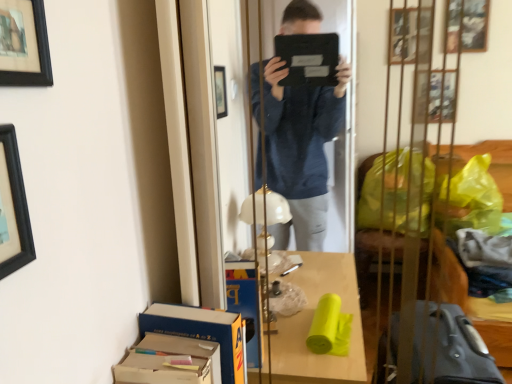
Locate an element on the screen. This screenshot has height=384, width=512. black matte picture frame at upper left, the first picture frame positioned from the bottom is located at coordinates (13, 207).

The width and height of the screenshot is (512, 384). What do you see at coordinates (201, 332) in the screenshot? I see `cardboard box at lower left, the 2th cardboard box in the front-to-back sequence` at bounding box center [201, 332].

Describe the element at coordinates (24, 44) in the screenshot. I see `black matte picture frame at upper left, which appears as the 1th picture frame when viewed from the top` at that location.

This screenshot has width=512, height=384. Identify the location of cardboard box at lower left, arranged as the 2th cardboard box when viewed from the back. (168, 361).

Where is `black matte picture frame at upper left, acting as the second picture frame starting from the top`? black matte picture frame at upper left, acting as the second picture frame starting from the top is located at coordinates (13, 207).

From their relative heights in the image, would you say cardboard box at lower left, which ranks as the first cardboard box in front-to-back order, is taller or shorter than cardboard box at lower left, the 1th cardboard box when ordered from back to front?

Clearly, cardboard box at lower left, which ranks as the first cardboard box in front-to-back order, is shorter compared to cardboard box at lower left, the 1th cardboard box when ordered from back to front.

Looking at this image, from a real-world perspective, is cardboard box at lower left, arranged as the 2th cardboard box when viewed from the back, positioned above or below cardboard box at lower left, the 1th cardboard box when ordered from back to front?

Clearly, from a real-world perspective, cardboard box at lower left, arranged as the 2th cardboard box when viewed from the back, is below cardboard box at lower left, the 1th cardboard box when ordered from back to front.

Which is correct: cardboard box at lower left, which ranks as the first cardboard box in front-to-back order, is inside cardboard box at lower left, the 2th cardboard box in the front-to-back sequence, or outside of it?

cardboard box at lower left, which ranks as the first cardboard box in front-to-back order, is outside cardboard box at lower left, the 2th cardboard box in the front-to-back sequence.

From the image's perspective, is cardboard box at lower left, which ranks as the first cardboard box in front-to-back order, located beneath cardboard box at lower left, the 1th cardboard box when ordered from back to front?

Yes, from the image's perspective, cardboard box at lower left, which ranks as the first cardboard box in front-to-back order, is beneath cardboard box at lower left, the 1th cardboard box when ordered from back to front.

Where is `cardboard box that is the 2nd object located behind the black matte picture frame at upper left, acting as the second picture frame starting from the top`? cardboard box that is the 2nd object located behind the black matte picture frame at upper left, acting as the second picture frame starting from the top is located at coordinates (201, 332).

Looking at this image, is the position of cardboard box at lower left, the 2th cardboard box in the front-to-back sequence, more distant than that of black matte picture frame at upper left, the first picture frame positioned from the bottom?

Yes, it is.

Can you confirm if cardboard box at lower left, the 1th cardboard box when ordered from back to front, is thinner than black matte picture frame at upper left, the first picture frame positioned from the bottom?

No, cardboard box at lower left, the 1th cardboard box when ordered from back to front, is not thinner than black matte picture frame at upper left, the first picture frame positioned from the bottom.

From a real-world perspective, between cardboard box at lower left, the 1th cardboard box when ordered from back to front, and black matte picture frame at upper left, acting as the second picture frame starting from the top, who is vertically higher?

black matte picture frame at upper left, acting as the second picture frame starting from the top, is physically above.

Is black matte picture frame at upper left, the first picture frame positioned from the bottom, situated inside cardboard box at lower left, arranged as the 2th cardboard box when viewed from the back, or outside?

The correct answer is: outside.

Is black matte picture frame at upper left, acting as the second picture frame starting from the top, behind cardboard box at lower left, which ranks as the first cardboard box in front-to-back order?

No, black matte picture frame at upper left, acting as the second picture frame starting from the top, is in front of cardboard box at lower left, which ranks as the first cardboard box in front-to-back order.

Is black matte picture frame at upper left, the first picture frame positioned from the bottom, directly adjacent to cardboard box at lower left, which ranks as the first cardboard box in front-to-back order?

black matte picture frame at upper left, the first picture frame positioned from the bottom, is not next to cardboard box at lower left, which ranks as the first cardboard box in front-to-back order, and they're not touching.

From a real-world perspective, count 1st picture frames upward from the cardboard box at lower left, arranged as the 2th cardboard box when viewed from the back, and point to it. Please provide its 2D coordinates.

[(13, 207)]

Is cardboard box at lower left, the 1th cardboard box when ordered from back to front, to the left of black matte picture frame at upper left, which appears as the 1th picture frame when viewed from the top, from the viewer's perspective?

In fact, cardboard box at lower left, the 1th cardboard box when ordered from back to front, is to the right of black matte picture frame at upper left, which appears as the 1th picture frame when viewed from the top.

Could you tell me if cardboard box at lower left, the 1th cardboard box when ordered from back to front, is turned towards black matte picture frame at upper left, which appears as the 1th picture frame when viewed from the top?

No, cardboard box at lower left, the 1th cardboard box when ordered from back to front, is not turned towards black matte picture frame at upper left, which appears as the 1th picture frame when viewed from the top.

From the image's perspective, starting from the black matte picture frame at upper left, which appears as the 1th picture frame when viewed from the top, which cardboard box is the 1st one below? Please provide its 2D coordinates.

[(201, 332)]

Is black matte picture frame at upper left, acting as the second picture frame starting from the top, looking in the opposite direction of black matte picture frame at upper left, which appears as the 1th picture frame when viewed from the top?

No, black matte picture frame at upper left, acting as the second picture frame starting from the top, is not facing the opposite direction of black matte picture frame at upper left, which appears as the 1th picture frame when viewed from the top.

Based on the photo, is black matte picture frame at upper left, the first picture frame positioned from the bottom, directly adjacent to black matte picture frame at upper left, acting as the 2th picture frame starting from the bottom?

No, black matte picture frame at upper left, the first picture frame positioned from the bottom, is not with black matte picture frame at upper left, acting as the 2th picture frame starting from the bottom.

What's the angular difference between black matte picture frame at upper left, the first picture frame positioned from the bottom, and black matte picture frame at upper left, acting as the 2th picture frame starting from the bottom,'s facing directions?

There is a 0.0352-degree angle between the facing directions of black matte picture frame at upper left, the first picture frame positioned from the bottom, and black matte picture frame at upper left, acting as the 2th picture frame starting from the bottom.

Can black matte picture frame at upper left, acting as the 2th picture frame starting from the bottom, be found inside black matte picture frame at upper left, the first picture frame positioned from the bottom?

That's incorrect, black matte picture frame at upper left, acting as the 2th picture frame starting from the bottom, is not inside black matte picture frame at upper left, the first picture frame positioned from the bottom.

Considering the positions of objects cardboard box at lower left, the 2th cardboard box in the front-to-back sequence, and cardboard box at lower left, arranged as the 2th cardboard box when viewed from the back, in the image provided, who is behind, cardboard box at lower left, the 2th cardboard box in the front-to-back sequence, or cardboard box at lower left, arranged as the 2th cardboard box when viewed from the back,?

cardboard box at lower left, the 2th cardboard box in the front-to-back sequence.

How distant is cardboard box at lower left, the 1th cardboard box when ordered from back to front, from cardboard box at lower left, arranged as the 2th cardboard box when viewed from the back?

cardboard box at lower left, the 1th cardboard box when ordered from back to front, is 2.10 inches away from cardboard box at lower left, arranged as the 2th cardboard box when viewed from the back.

Is cardboard box at lower left, the 1th cardboard box when ordered from back to front, placed right next to cardboard box at lower left, which ranks as the first cardboard box in front-to-back order?

Yes, cardboard box at lower left, the 1th cardboard box when ordered from back to front, is with cardboard box at lower left, which ranks as the first cardboard box in front-to-back order.

From the image's perspective, between cardboard box at lower left, the 1th cardboard box when ordered from back to front, and cardboard box at lower left, arranged as the 2th cardboard box when viewed from the back, which one is located above?

cardboard box at lower left, the 1th cardboard box when ordered from back to front.

Consider the image. From the image's perspective, is cardboard box at lower left, which ranks as the first cardboard box in front-to-back order, located above or below black matte picture frame at upper left, acting as the 2th picture frame starting from the bottom?

From the image's perspective, cardboard box at lower left, which ranks as the first cardboard box in front-to-back order, appears below black matte picture frame at upper left, acting as the 2th picture frame starting from the bottom.

Looking at this image, measure the distance from cardboard box at lower left, which ranks as the first cardboard box in front-to-back order, to black matte picture frame at upper left, acting as the 2th picture frame starting from the bottom.

A distance of 21.71 inches exists between cardboard box at lower left, which ranks as the first cardboard box in front-to-back order, and black matte picture frame at upper left, acting as the 2th picture frame starting from the bottom.

Is cardboard box at lower left, arranged as the 2th cardboard box when viewed from the back, not close to black matte picture frame at upper left, which appears as the 1th picture frame when viewed from the top?

That's not correct — cardboard box at lower left, arranged as the 2th cardboard box when viewed from the back, is a little close to black matte picture frame at upper left, which appears as the 1th picture frame when viewed from the top.

Based on their sizes in the image, would you say cardboard box at lower left, arranged as the 2th cardboard box when viewed from the back, is bigger or smaller than black matte picture frame at upper left, which appears as the 1th picture frame when viewed from the top?

Considering their sizes, cardboard box at lower left, arranged as the 2th cardboard box when viewed from the back, takes up more space than black matte picture frame at upper left, which appears as the 1th picture frame when viewed from the top.

Locate an element on the screen. cardboard box behind the cardboard box at lower left, arranged as the 2th cardboard box when viewed from the back is located at coordinates (201, 332).

I want to click on the 2nd picture frame to the left when counting from the cardboard box at lower left, the 1th cardboard box when ordered from back to front, so click(x=13, y=207).

Considering their positions, is black matte picture frame at upper left, acting as the 2th picture frame starting from the bottom, positioned closer to cardboard box at lower left, arranged as the 2th cardboard box when viewed from the back, than cardboard box at lower left, the 2th cardboard box in the front-to-back sequence?

cardboard box at lower left, the 2th cardboard box in the front-to-back sequence, lies closer to cardboard box at lower left, arranged as the 2th cardboard box when viewed from the back, than the other object.

Looking at the image, which one is located closer to cardboard box at lower left, arranged as the 2th cardboard box when viewed from the back, black matte picture frame at upper left, the first picture frame positioned from the bottom, or cardboard box at lower left, the 2th cardboard box in the front-to-back sequence?

cardboard box at lower left, the 2th cardboard box in the front-to-back sequence, lies closer to cardboard box at lower left, arranged as the 2th cardboard box when viewed from the back, than the other object.

Estimate the real-world distances between objects in this image. Which object is further from black matte picture frame at upper left, acting as the second picture frame starting from the top, black matte picture frame at upper left, acting as the 2th picture frame starting from the bottom, or cardboard box at lower left, which ranks as the first cardboard box in front-to-back order?

Based on the image, cardboard box at lower left, which ranks as the first cardboard box in front-to-back order, appears to be further to black matte picture frame at upper left, acting as the second picture frame starting from the top.

Considering their positions, is cardboard box at lower left, which ranks as the first cardboard box in front-to-back order, positioned closer to black matte picture frame at upper left, which appears as the 1th picture frame when viewed from the top, than cardboard box at lower left, the 2th cardboard box in the front-to-back sequence?

Among the two, cardboard box at lower left, which ranks as the first cardboard box in front-to-back order, is located nearer to black matte picture frame at upper left, which appears as the 1th picture frame when viewed from the top.

Which object lies further to the anchor point black matte picture frame at upper left, acting as the 2th picture frame starting from the bottom, cardboard box at lower left, the 1th cardboard box when ordered from back to front, or black matte picture frame at upper left, acting as the second picture frame starting from the top?

cardboard box at lower left, the 1th cardboard box when ordered from back to front, is further to black matte picture frame at upper left, acting as the 2th picture frame starting from the bottom.

Looking at the image, which one is located further to cardboard box at lower left, arranged as the 2th cardboard box when viewed from the back, black matte picture frame at upper left, acting as the 2th picture frame starting from the bottom, or black matte picture frame at upper left, acting as the second picture frame starting from the top?

black matte picture frame at upper left, acting as the 2th picture frame starting from the bottom, lies further to cardboard box at lower left, arranged as the 2th cardboard box when viewed from the back, than the other object.

When comparing their distances from cardboard box at lower left, the 2th cardboard box in the front-to-back sequence, does black matte picture frame at upper left, acting as the second picture frame starting from the top, or cardboard box at lower left, arranged as the 2th cardboard box when viewed from the back, seem closer?

Based on the image, cardboard box at lower left, arranged as the 2th cardboard box when viewed from the back, appears to be nearer to cardboard box at lower left, the 2th cardboard box in the front-to-back sequence.

Considering their positions, is cardboard box at lower left, arranged as the 2th cardboard box when viewed from the back, positioned closer to black matte picture frame at upper left, acting as the 2th picture frame starting from the bottom, than black matte picture frame at upper left, the first picture frame positioned from the bottom?

Among the two, black matte picture frame at upper left, the first picture frame positioned from the bottom, is located nearer to black matte picture frame at upper left, acting as the 2th picture frame starting from the bottom.

Identify the location of cardboard box between black matte picture frame at upper left, the first picture frame positioned from the bottom, and cardboard box at lower left, the 2th cardboard box in the front-to-back sequence, from front to back. This screenshot has width=512, height=384. [x=168, y=361].

You are a GUI agent. You are given a task and a screenshot of the screen. Output one action in this format:
    pyautogui.click(x=<x>, y=<y>)
    Task: Click on the cardboard box between black matte picture frame at upper left, which appears as the 1th picture frame when viewed from the top, and cardboard box at lower left, arranged as the 2th cardboard box when viewed from the back, vertically
    
    Given the screenshot: What is the action you would take?
    pyautogui.click(x=201, y=332)

Locate an element on the screen. picture frame between black matte picture frame at upper left, which appears as the 1th picture frame when viewed from the top, and cardboard box at lower left, the 2th cardboard box in the front-to-back sequence, in the up-down direction is located at coordinates (13, 207).

This screenshot has height=384, width=512. In order to click on picture frame that lies between black matte picture frame at upper left, which appears as the 1th picture frame when viewed from the top, and cardboard box at lower left, arranged as the 2th cardboard box when viewed from the back, from top to bottom in this screenshot , I will do `click(13, 207)`.